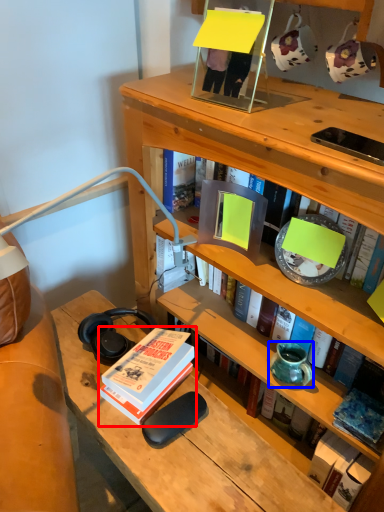
Question: Which point is closer to the camera, book (highlighted by a red box) or vase (highlighted by a blue box)?

Choices:
 (A) book
 (B) vase

Answer: (A)